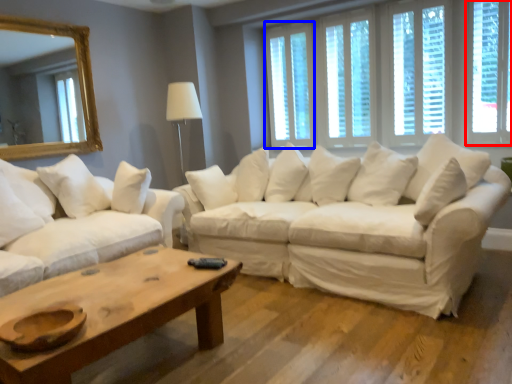
Question: Which of the following is the closest to the observer, window (highlighted by a red box) or window (highlighted by a blue box)?

Choices:
 (A) window
 (B) window

Answer: (A)